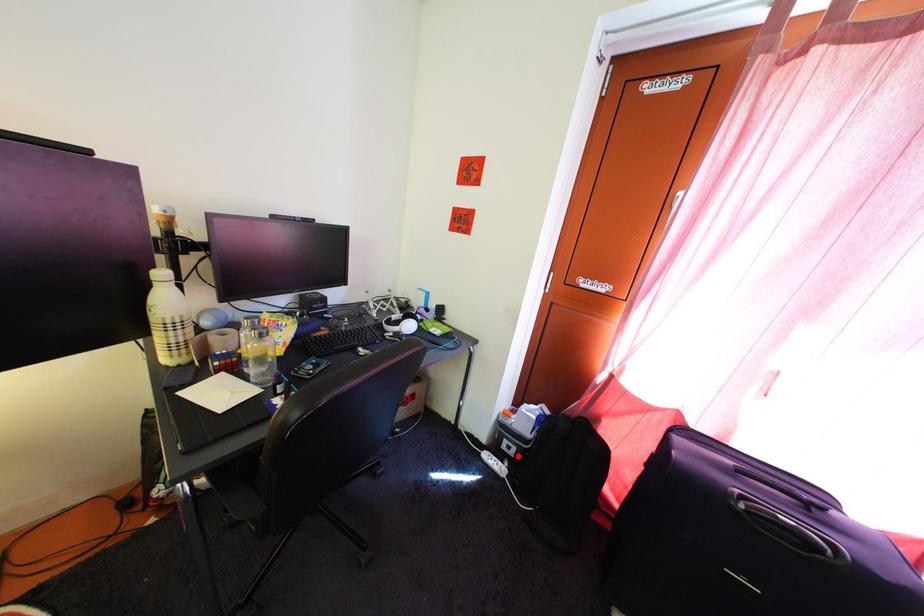
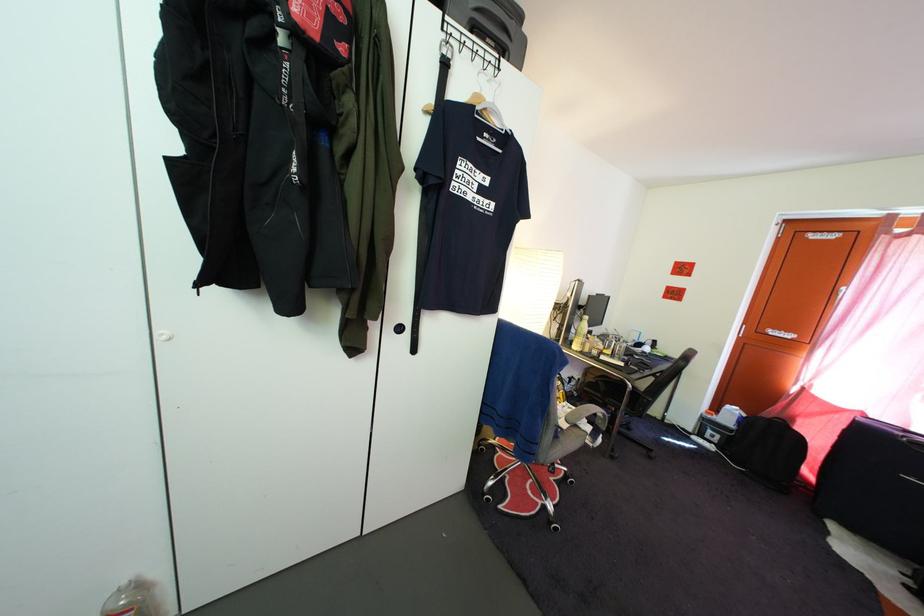
Question: I am providing you with two images of the same scene from different viewpoints. Image1 has a red point marked. In image2, the corresponding 3D location appears at what relative position? Reply with the corresponding letter.

Choices:
 (A) Closer
 (B) Farther

Answer: (A)